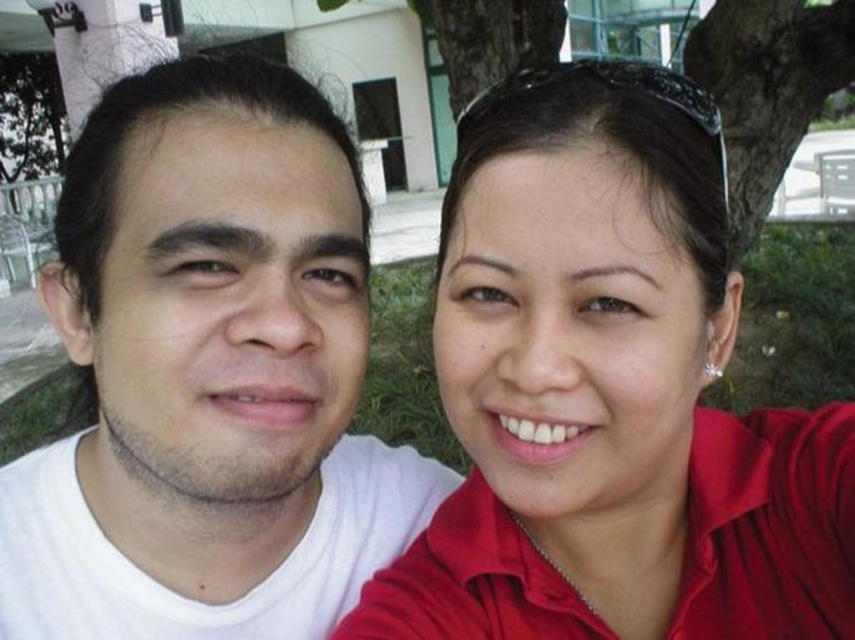
Is matte red shirt at right taller than white matte shirt at left?

Incorrect, matte red shirt at right's height is not larger of white matte shirt at left's.

Can you confirm if matte red shirt at right is wider than white matte shirt at left?

In fact, matte red shirt at right might be narrower than white matte shirt at left.

Does point (693, 188) come behind point (367, 472)?

No, it is in front of (367, 472).

Find the location of `matte red shirt at right`. matte red shirt at right is located at coordinates (609, 392).